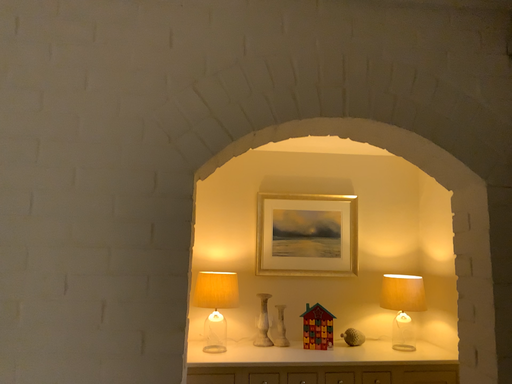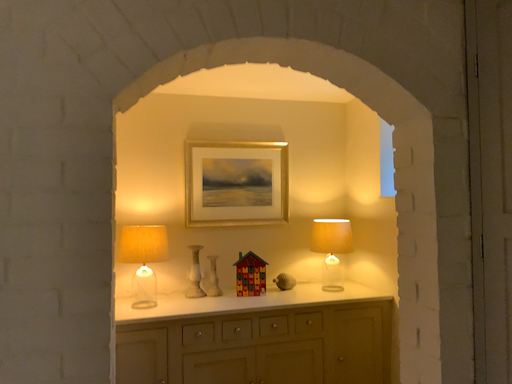
Question: How did the camera likely rotate when shooting the video?

Choices:
 (A) rotated left
 (B) rotated right

Answer: (B)